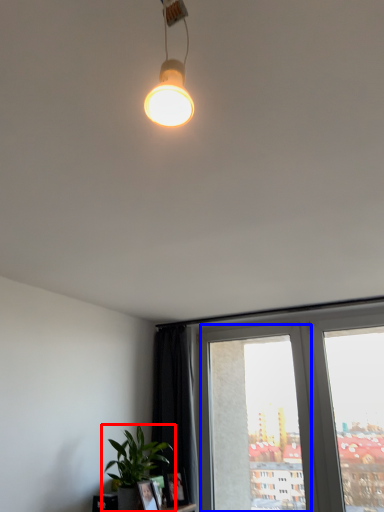
Question: Which point is closer to the camera, houseplant (highlighted by a red box) or window frame (highlighted by a blue box)?

Choices:
 (A) houseplant
 (B) window frame

Answer: (A)